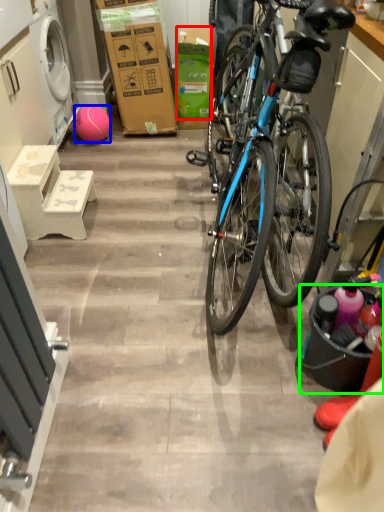
Question: Which object is the farthest from box (highlighted by a red box)? Choose among these: ball (highlighted by a blue box) or bucket (highlighted by a green box).

Choices:
 (A) ball
 (B) bucket

Answer: (B)